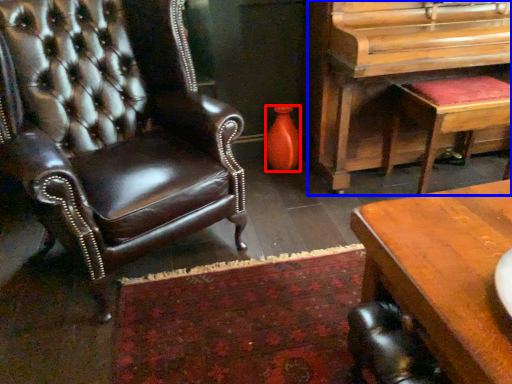
Question: Which of the following is the closest to the observer, vase (highlighted by a red box) or piano (highlighted by a blue box)?

Choices:
 (A) vase
 (B) piano

Answer: (B)